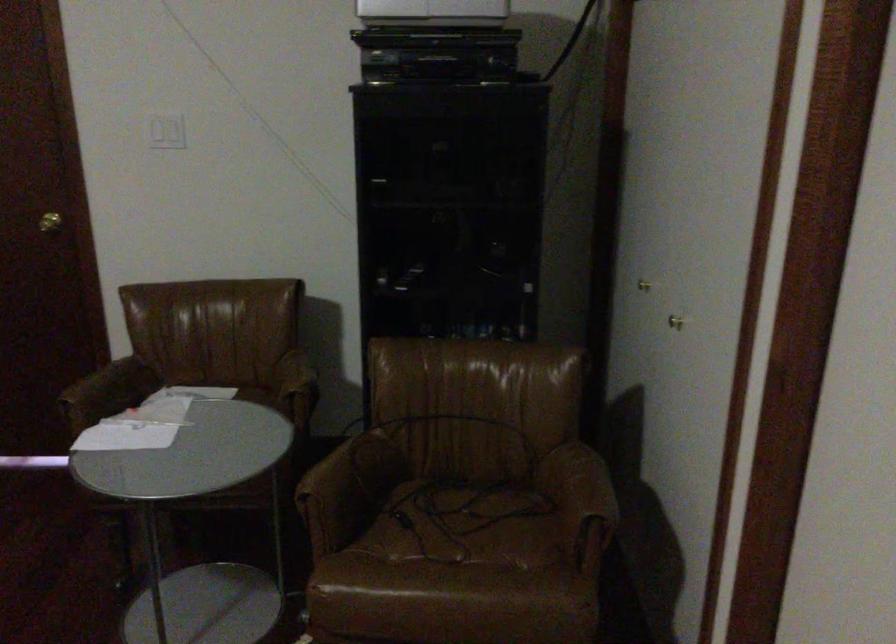
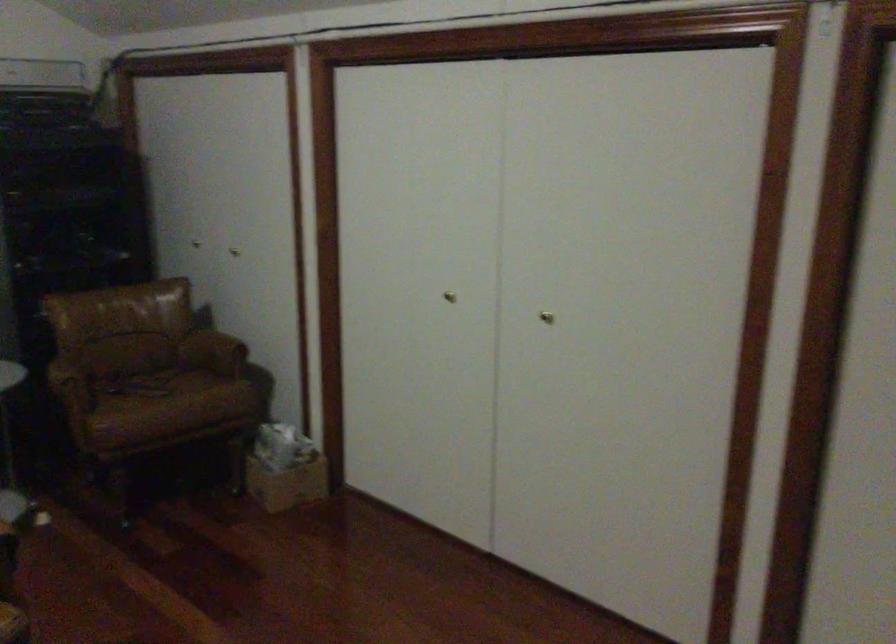
The point at (582, 485) is marked in the first image. Where is the corresponding point in the second image?

(220, 337)